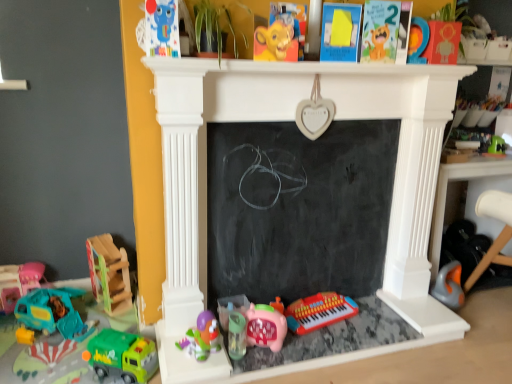
Image resolution: width=512 pixels, height=384 pixels. Find the location of `free space that is to the left of green plastic toy truck at lower left, which is the ninth toy from right to left`. free space that is to the left of green plastic toy truck at lower left, which is the ninth toy from right to left is located at coordinates (72, 369).